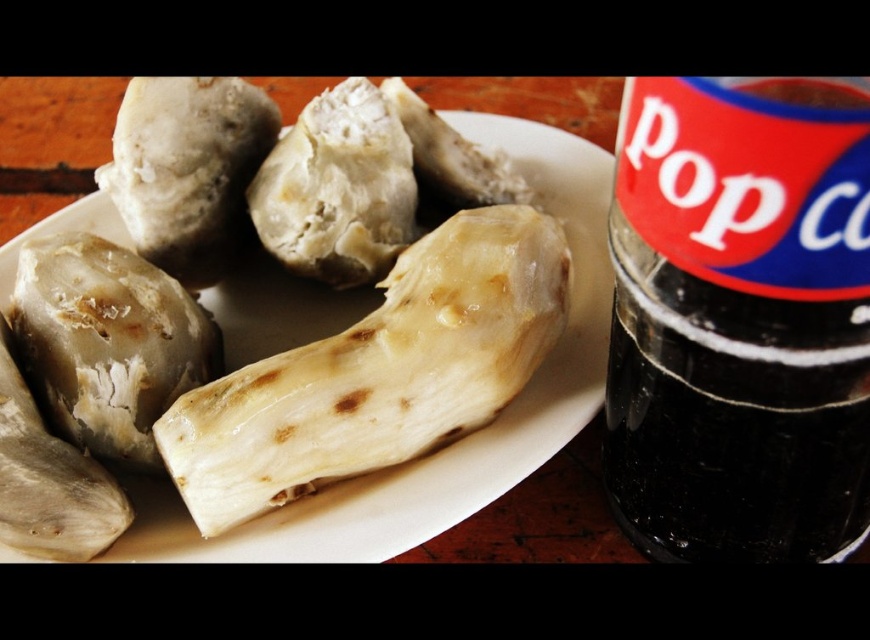
Is white matte plate at center taller than white matte food at center-left?

Yes, white matte plate at center is taller than white matte food at center-left.

Which is in front, point (504, 116) or point (7, 403)?

Point (7, 403) is in front.

Where is `white matte plate at center`? The width and height of the screenshot is (870, 640). white matte plate at center is located at coordinates (454, 442).

Does white matte food at center appear on the left side of white matte food at center-left?

No, white matte food at center is not to the left of white matte food at center-left.

Between point (219, 115) and point (25, 509), which one is positioned in front?

Point (25, 509)

Is point (152, 156) less distant than point (0, 365)?

No, it is not.

I want to click on white matte food at center, so click(x=186, y=170).

This screenshot has width=870, height=640. In order to click on white matte plate at center in this screenshot , I will do `click(454, 442)`.

Is white matte plate at center shorter than white matte food at center?

In fact, white matte plate at center may be taller than white matte food at center.

Describe the element at coordinates (454, 442) in the screenshot. This screenshot has width=870, height=640. I see `white matte plate at center` at that location.

Identify the location of white matte plate at center. Image resolution: width=870 pixels, height=640 pixels. (454, 442).